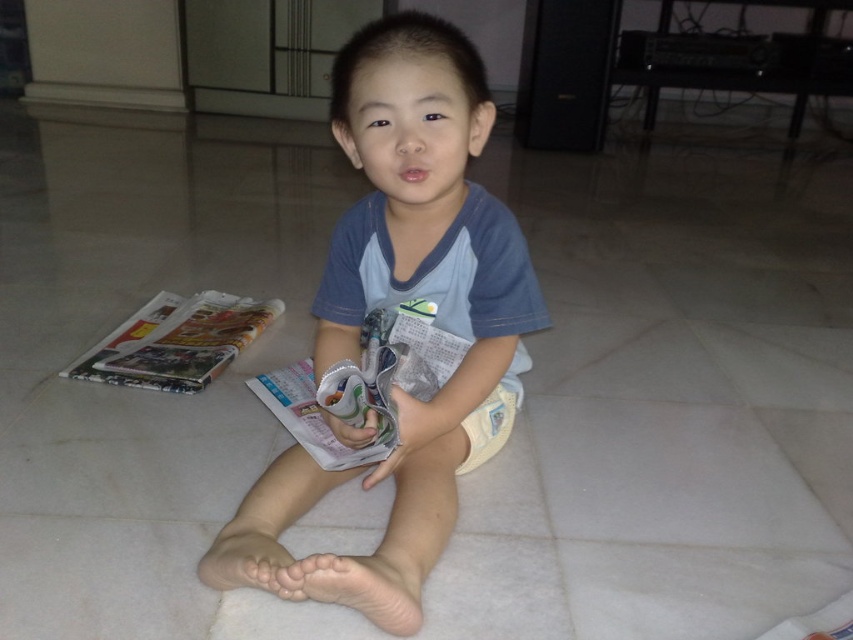
Is point (367, 298) farther from viewer compared to point (292, 433)?

No, (367, 298) is closer to viewer.

Can you confirm if blue cotton shirt at center is positioned to the left of printed paper magazine at center?

In fact, blue cotton shirt at center is to the right of printed paper magazine at center.

Locate an element on the screen. This screenshot has width=853, height=640. blue cotton shirt at center is located at coordinates (396, 301).

The width and height of the screenshot is (853, 640). What are the coordinates of `printed paper magazine at center` in the screenshot? It's located at (363, 385).

Describe the element at coordinates (363, 385) in the screenshot. I see `printed paper magazine at center` at that location.

Find the location of a particular element. printed paper magazine at center is located at coordinates (363, 385).

Who is more distant from viewer, (506, 387) or (122, 332)?

The point (122, 332) is behind.

Is blue cotton shirt at center thinner than printed paper magazine at left?

In fact, blue cotton shirt at center might be wider than printed paper magazine at left.

Where is `blue cotton shirt at center`? The width and height of the screenshot is (853, 640). blue cotton shirt at center is located at coordinates (396, 301).

This screenshot has height=640, width=853. Find the location of `blue cotton shirt at center`. blue cotton shirt at center is located at coordinates (396, 301).